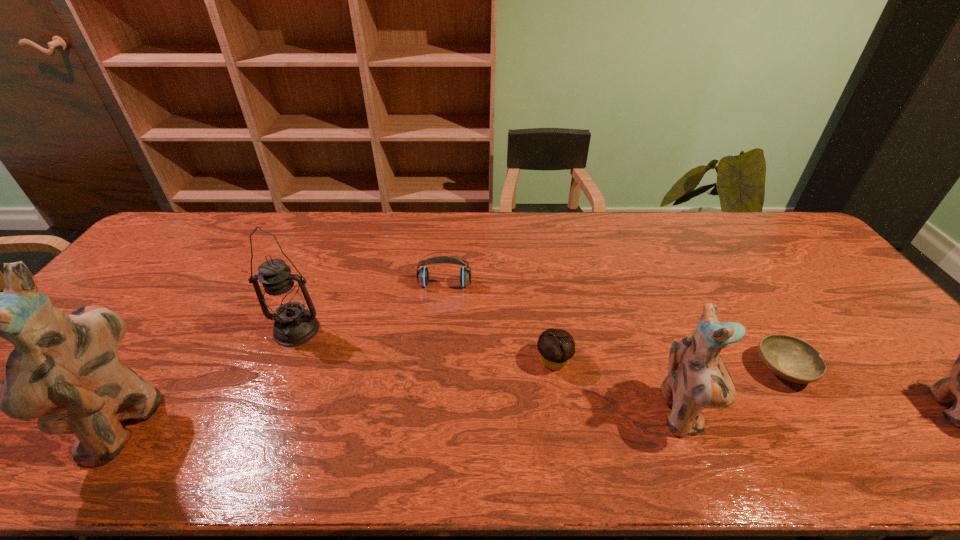
Identify the location of the tallest object. (65, 370).

Find the location of `the leftmost figurine`. the leftmost figurine is located at coordinates (65, 370).

The image size is (960, 540). In order to click on the second tallest figurine in this screenshot , I will do `click(697, 378)`.

Identify the location of the second figurine from right to left. This screenshot has height=540, width=960. (697, 378).

The height and width of the screenshot is (540, 960). I want to click on headset, so click(423, 275).

This screenshot has width=960, height=540. Find the location of `the third shortest object`. the third shortest object is located at coordinates (423, 275).

This screenshot has height=540, width=960. Find the location of `the sixth object from left to right`. the sixth object from left to right is located at coordinates (790, 358).

The width and height of the screenshot is (960, 540). I want to click on the shortest object, so click(x=790, y=358).

Where is `oil lamp`? oil lamp is located at coordinates (284, 301).

Where is `muffin`? muffin is located at coordinates (556, 347).